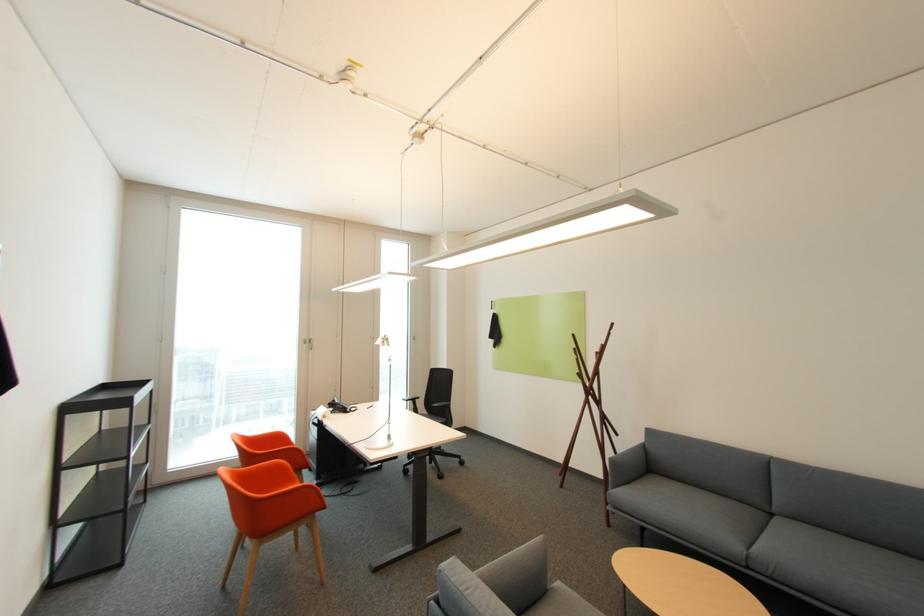
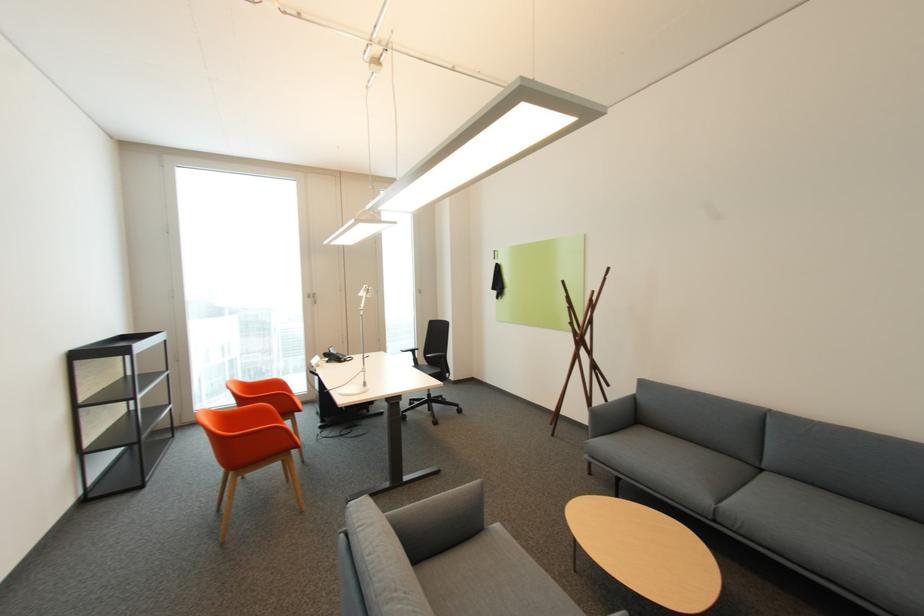
Question: Based on the continuous images, in which direction is the camera rotating? Reply with the corresponding letter.

Choices:
 (A) Left
 (B) Right
 (C) Up
 (D) Down

Answer: (D)